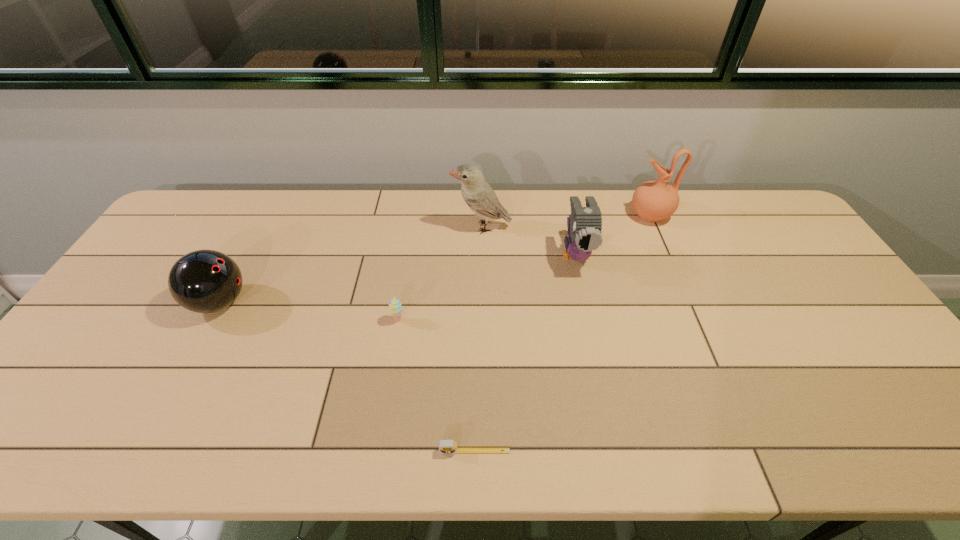
Find the location of a particular element. This screenshot has width=960, height=540. pottery is located at coordinates [653, 201].

Identify the location of the left bird. The image size is (960, 540). (477, 193).

You are a GUI agent. You are given a task and a screenshot of the screen. Output one action in this format:
    pyautogui.click(x=<x>, y=<y>)
    Task: Click on the fifth object from left to right
    The image size is (960, 540).
    Given the screenshot: What is the action you would take?
    pyautogui.click(x=584, y=225)

Find the location of a particular element. the shorter bird is located at coordinates pos(584,225).

Where is `bowling ball`? bowling ball is located at coordinates (203, 281).

Locate an element on the screen. the fifth object from right to left is located at coordinates (395, 307).

At what (x,y) coordinates should I click in order to perform the action: click on sherbert. Please return your answer as a coordinate pair (x, y). This screenshot has height=540, width=960. Looking at the image, I should click on (395, 307).

Where is `tape measure`? The height and width of the screenshot is (540, 960). tape measure is located at coordinates (445, 446).

The height and width of the screenshot is (540, 960). I want to click on the shortest object, so click(x=445, y=446).

This screenshot has height=540, width=960. Find the location of `free spot located 0.290m on the spout of the pottery`. free spot located 0.290m on the spout of the pottery is located at coordinates 545,215.